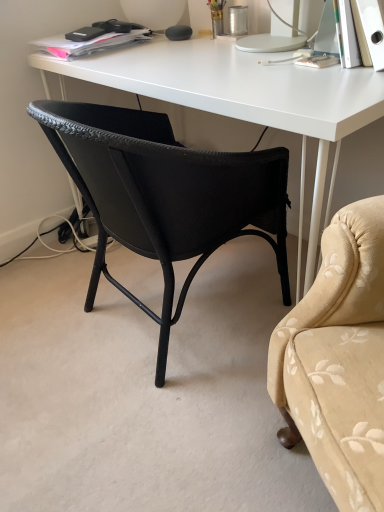
Question: Can you confirm if matte black charger at upper left is thinner than white matte desk at center?

Choices:
 (A) yes
 (B) no

Answer: (A)

Question: From a real-world perspective, is matte black charger at upper left on white matte desk at center?

Choices:
 (A) yes
 (B) no

Answer: (A)

Question: Is white matte desk at center at the back of matte black charger at upper left?

Choices:
 (A) no
 (B) yes

Answer: (A)

Question: Is matte black charger at upper left oriented towards white matte desk at center?

Choices:
 (A) yes
 (B) no

Answer: (B)

Question: Is matte black charger at upper left positioned before white matte desk at center?

Choices:
 (A) no
 (B) yes

Answer: (A)

Question: Considering the relative positions of matte black charger at upper left and white matte desk at center in the image provided, is matte black charger at upper left to the right of white matte desk at center from the viewer's perspective?

Choices:
 (A) yes
 (B) no

Answer: (B)

Question: Can you confirm if white matte desk at center is bigger than black woven chair at center?

Choices:
 (A) no
 (B) yes

Answer: (B)

Question: Can you confirm if white matte desk at center is positioned to the left of black woven chair at center?

Choices:
 (A) no
 (B) yes

Answer: (A)

Question: Is the position of white matte desk at center more distant than that of black woven chair at center?

Choices:
 (A) yes
 (B) no

Answer: (A)

Question: Can you confirm if white matte desk at center is taller than black woven chair at center?

Choices:
 (A) yes
 (B) no

Answer: (A)

Question: Is white matte desk at center outside black woven chair at center?

Choices:
 (A) no
 (B) yes

Answer: (B)

Question: From the image's perspective, is white matte desk at center beneath black woven chair at center?

Choices:
 (A) no
 (B) yes

Answer: (A)

Question: From a real-world perspective, is matte black charger at upper left on top of black woven chair at center?

Choices:
 (A) yes
 (B) no

Answer: (A)